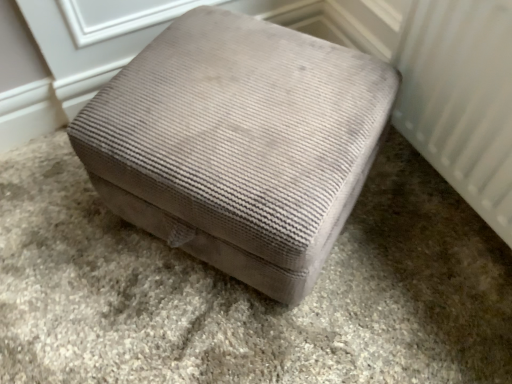
Image resolution: width=512 pixels, height=384 pixels. What are the coordinates of `free location to the left of velvet ottoman at center` in the screenshot? It's located at (57, 244).